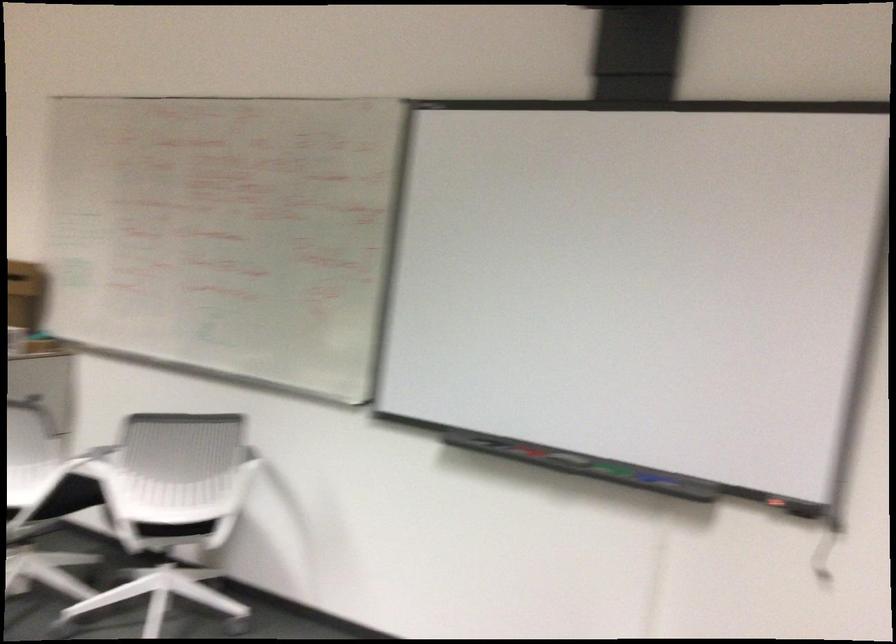
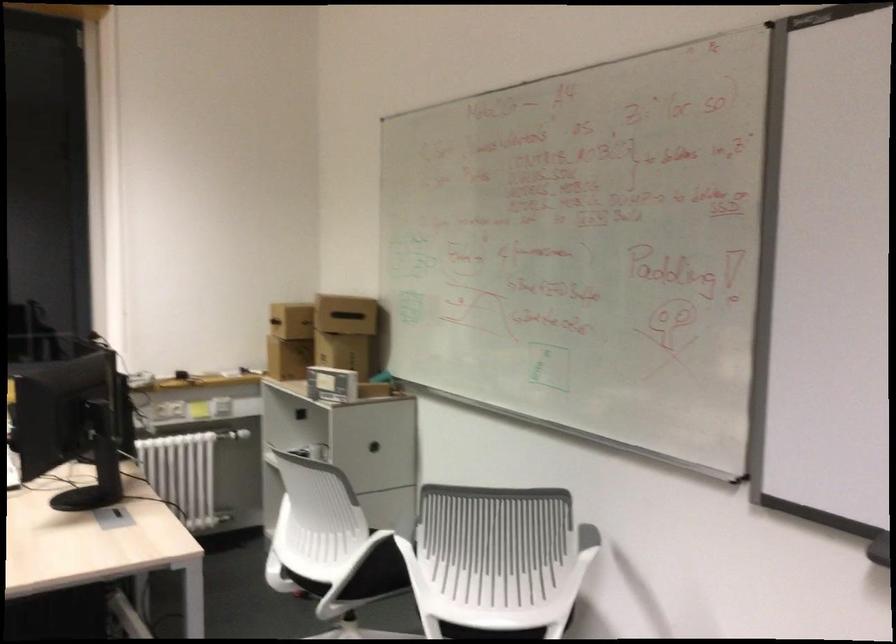
Question: In a continuous first-person perspective shot, in which direction is the camera moving?

Choices:
 (A) Left
 (B) Right
 (C) Forward
 (D) Backward

Answer: (C)